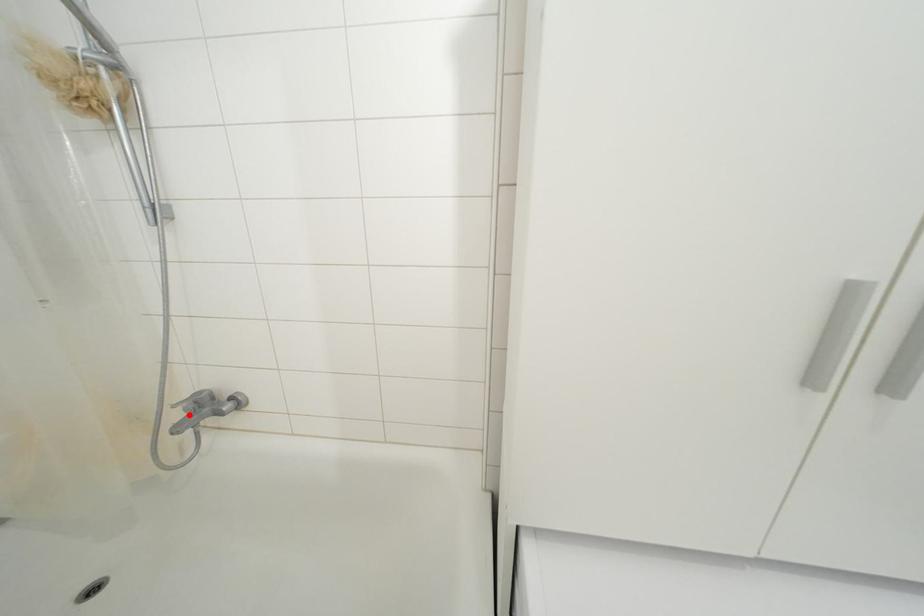
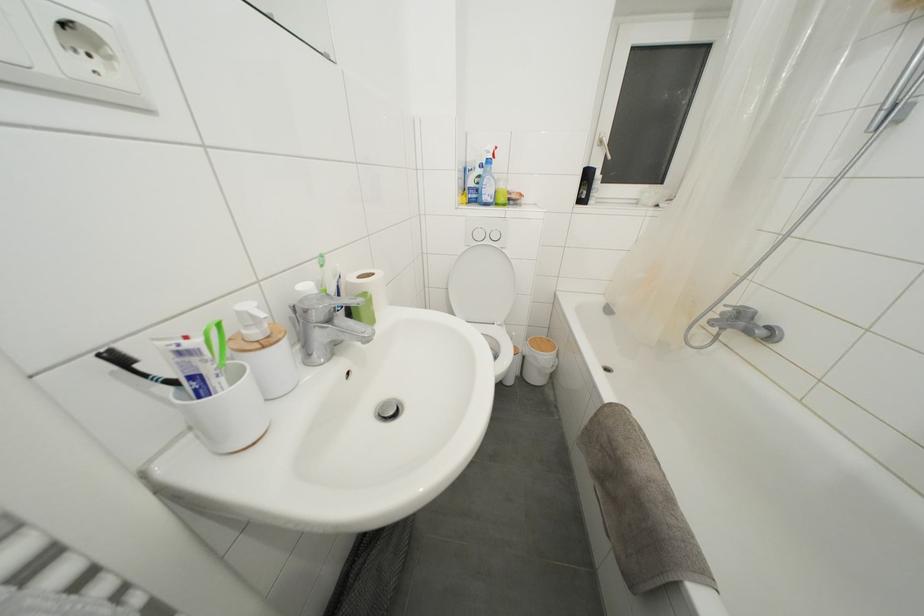
Locate, in the second image, the point that corresponds to the highlighted location in the first image.

(726, 318)